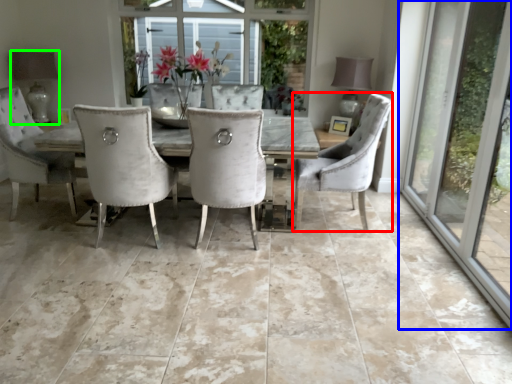
Question: Which object is positioned farthest from chair (highlighted by a red box)? Select from window (highlighted by a blue box) and lamp (highlighted by a green box).

Choices:
 (A) window
 (B) lamp

Answer: (B)